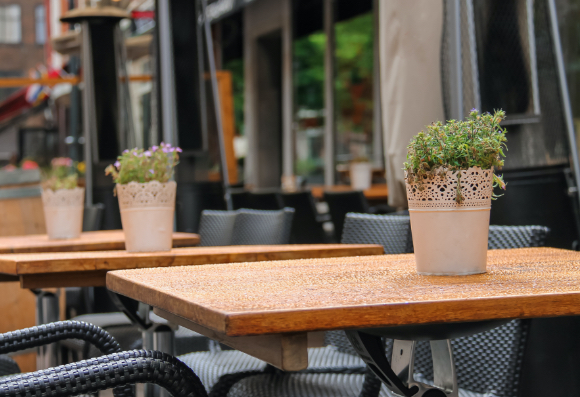
Where is `brown wooden tables`? The image size is (580, 397). brown wooden tables is located at coordinates (271, 301), (345, 266), (306, 243), (229, 250), (66, 259), (102, 240), (186, 232), (36, 244), (319, 184), (380, 185).